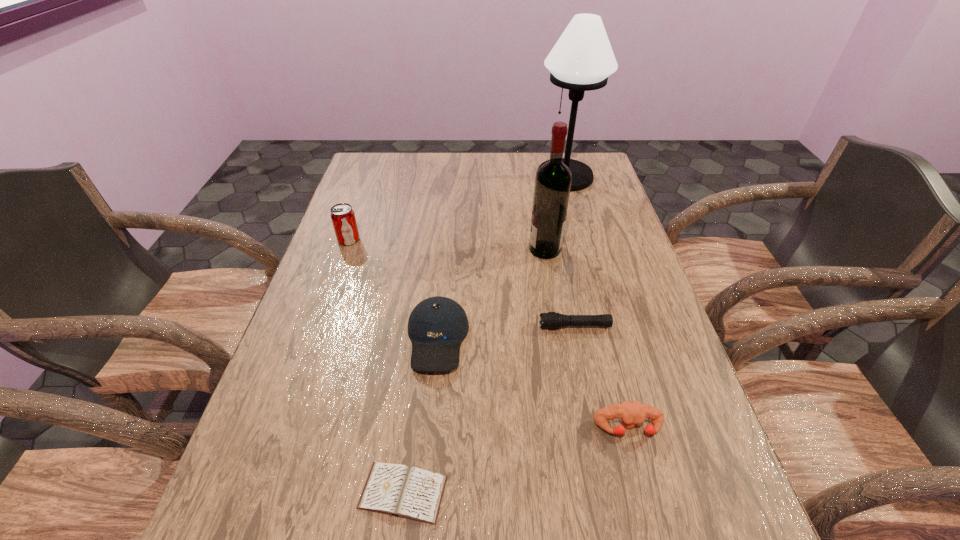
Identify the location of the tallest object. The height and width of the screenshot is (540, 960). (582, 59).

Find the location of `table lamp`. table lamp is located at coordinates (582, 59).

You are a GUI agent. You are given a task and a screenshot of the screen. Output one action in this format:
    pyautogui.click(x=<x>, y=<y>)
    Task: Click on the sixth shortest object
    
    Given the screenshot: What is the action you would take?
    pyautogui.click(x=553, y=179)

Find the location of a particular element. This screenshot has width=960, height=540. the third tallest object is located at coordinates (342, 215).

At what (x,y) coordinates should I click in order to perform the action: click on the leftmost object. Please return your answer as a coordinate pair (x, y). The height and width of the screenshot is (540, 960). Looking at the image, I should click on (342, 215).

This screenshot has height=540, width=960. Find the location of `baseball cap`. baseball cap is located at coordinates (437, 325).

Locate an element on the screen. Image resolution: width=960 pixels, height=540 pixels. the third shortest object is located at coordinates (632, 413).

Locate an element on the screen. The height and width of the screenshot is (540, 960). puncher is located at coordinates (632, 413).

Find the location of a particular element. This screenshot has width=960, height=540. flashlight is located at coordinates (551, 320).

You are a GUI agent. You are given a task and a screenshot of the screen. Output one action in this format:
    pyautogui.click(x=<x>, y=<y>)
    Task: Click on the diary
    
    Given the screenshot: What is the action you would take?
    pyautogui.click(x=398, y=490)